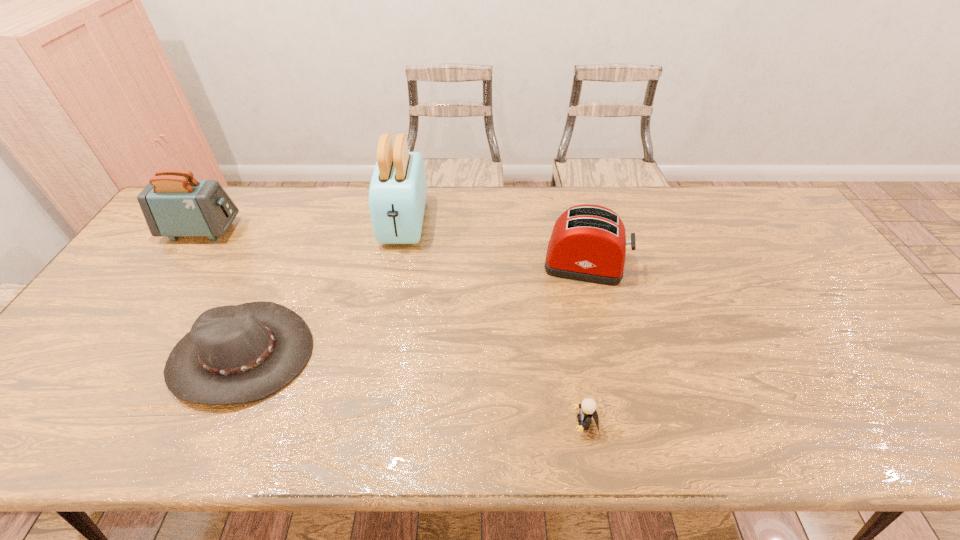
I want to click on vacant space situated 0.050m on the front-facing side of the second shortest toaster, so click(252, 230).

Where is `free space located 0.240m on the back of the third shortest object`? Image resolution: width=960 pixels, height=540 pixels. free space located 0.240m on the back of the third shortest object is located at coordinates (569, 198).

What are the coordinates of `vacant space located on the front-facing side of the hat` in the screenshot? It's located at pos(205,436).

Locate an element on the screen. Image resolution: width=960 pixels, height=540 pixels. vacant space located on the front-facing side of the shortest object is located at coordinates (409, 423).

Locate an element on the screen. This screenshot has height=540, width=960. vacant area located 0.140m on the front-facing side of the shortest object is located at coordinates (509, 423).

The image size is (960, 540). I want to click on vacant space located on the front-facing side of the shortest object, so coord(518,423).

Image resolution: width=960 pixels, height=540 pixels. Identify the location of hat present at the near edge. (234, 354).

Locate an element on the screen. This screenshot has width=960, height=540. Lego that is at the near edge is located at coordinates (588, 406).

This screenshot has width=960, height=540. I want to click on object located in the left edge section of the desktop, so click(x=174, y=204).

Where is `object situated at the far left corner`? object situated at the far left corner is located at coordinates [x=174, y=204].